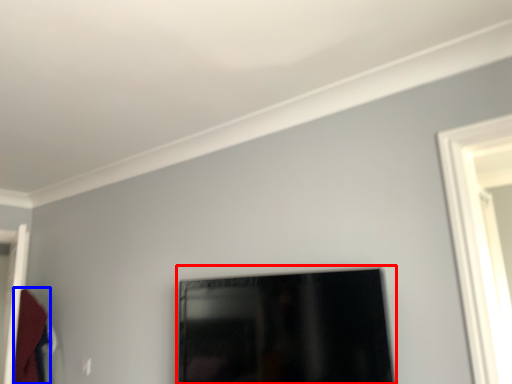
Question: Among these objects, which one is nearest to the camera, picture frame (highlighted by a red box) or robe (highlighted by a blue box)?

Choices:
 (A) picture frame
 (B) robe

Answer: (A)